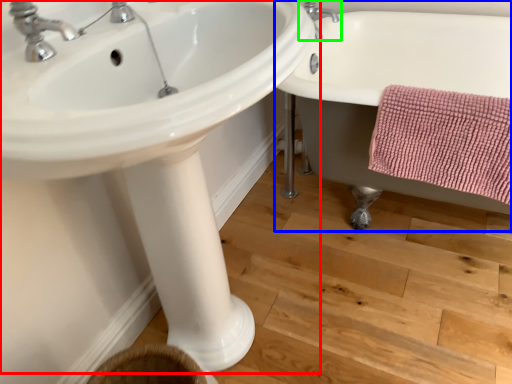
Question: Considering the real-world distances, which object is closest to sink (highlighted by a red box)? bathtub (highlighted by a blue box) or tap (highlighted by a green box).

Choices:
 (A) bathtub
 (B) tap

Answer: (A)